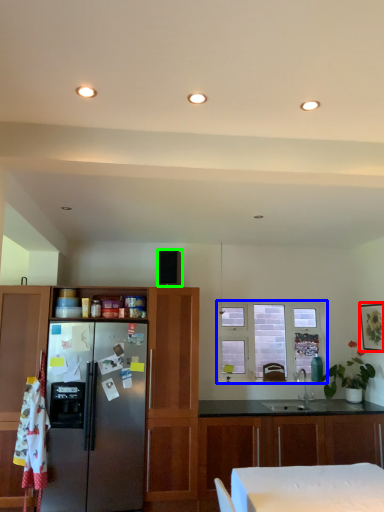
Question: Which object is positioned closest to picture frame (highlighted by a red box)? Select from window (highlighted by a blue box) and appliance (highlighted by a green box).

Choices:
 (A) window
 (B) appliance

Answer: (A)